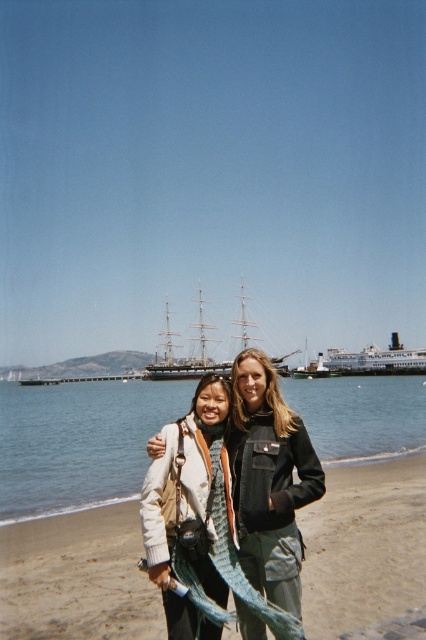
You are standing at the point with coordinates point (189, 364) and want to walk towards the point with coordinates point (397, 616). Based on the scene description, will you be moving towards the ship or away from it?

Based on the scene description, point (397, 616) is in front of point (189, 364). Since the ship is docked near the shore in the background, moving towards point (397, 616) would mean moving away from the ship.

You are a photographer trying to capture a clear shot of the white glossy ferry at center without any obstructions. Based on the scene, is the blue water at center blocking the ferry in your view?

The blue water at center is in front of the white glossy ferry at center, so it is blocking the ferry in your view.